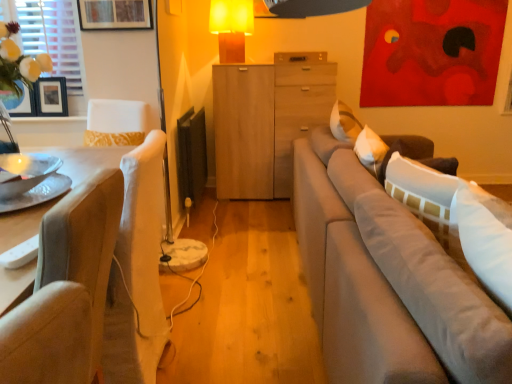
Question: Is matte glass vase at left at the left side of metallic silver tray at left?

Choices:
 (A) no
 (B) yes

Answer: (B)

Question: Could you tell me if matte glass vase at left is turned towards metallic silver tray at left?

Choices:
 (A) no
 (B) yes

Answer: (A)

Question: From the image's perspective, would you say matte glass vase at left is shown under metallic silver tray at left?

Choices:
 (A) yes
 (B) no

Answer: (B)

Question: From the image's perspective, is matte glass vase at left located above metallic silver tray at left?

Choices:
 (A) yes
 (B) no

Answer: (A)

Question: Does matte glass vase at left appear on the right side of metallic silver tray at left?

Choices:
 (A) yes
 (B) no

Answer: (B)

Question: Based on their sizes in the image, would you say matte glass vase at left is bigger or smaller than metallic silver tray at left?

Choices:
 (A) small
 (B) big

Answer: (A)

Question: Considering their positions, is matte glass vase at left located in front of or behind metallic silver tray at left?

Choices:
 (A) front
 (B) behind

Answer: (B)

Question: In terms of width, does matte glass vase at left look wider or thinner when compared to metallic silver tray at left?

Choices:
 (A) wide
 (B) thin

Answer: (B)

Question: From the image's perspective, is matte glass vase at left above or below metallic silver tray at left?

Choices:
 (A) above
 (B) below

Answer: (A)

Question: In the image, is white fabric window screen at upper left positioned in front of or behind wooden drawer at center?

Choices:
 (A) behind
 (B) front

Answer: (B)

Question: Is white fabric window screen at upper left inside the boundaries of wooden drawer at center, or outside?

Choices:
 (A) outside
 (B) inside

Answer: (A)

Question: Looking at their shapes, would you say white fabric window screen at upper left is wider or thinner than wooden drawer at center?

Choices:
 (A) wide
 (B) thin

Answer: (B)

Question: From a real-world perspective, is white fabric window screen at upper left positioned above or below wooden drawer at center?

Choices:
 (A) below
 (B) above

Answer: (B)

Question: Considering the positions of light wood cabinet at center and white fabric window screen at upper left in the image, is light wood cabinet at center taller or shorter than white fabric window screen at upper left?

Choices:
 (A) short
 (B) tall

Answer: (B)

Question: In the image, is light wood cabinet at center positioned in front of or behind white fabric window screen at upper left?

Choices:
 (A) behind
 (B) front

Answer: (A)